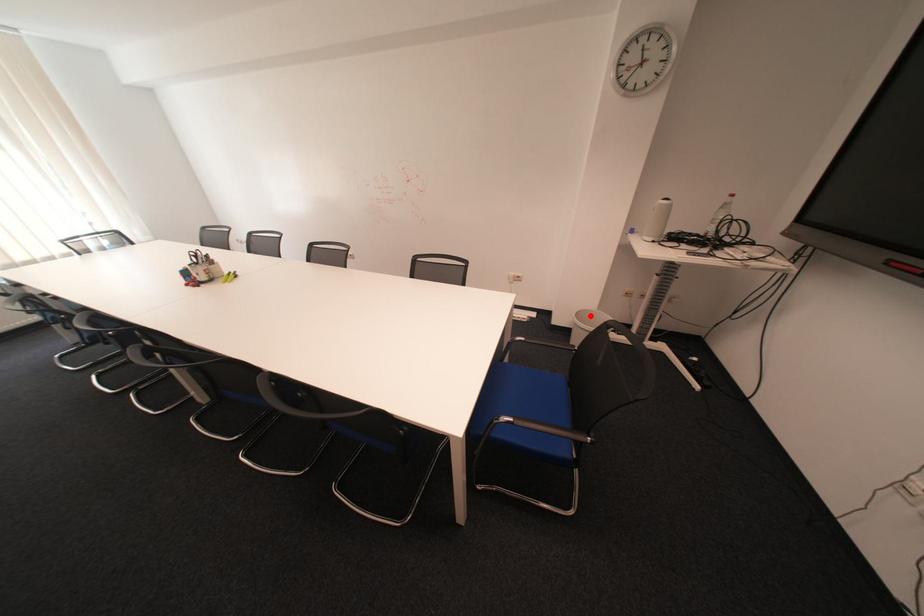
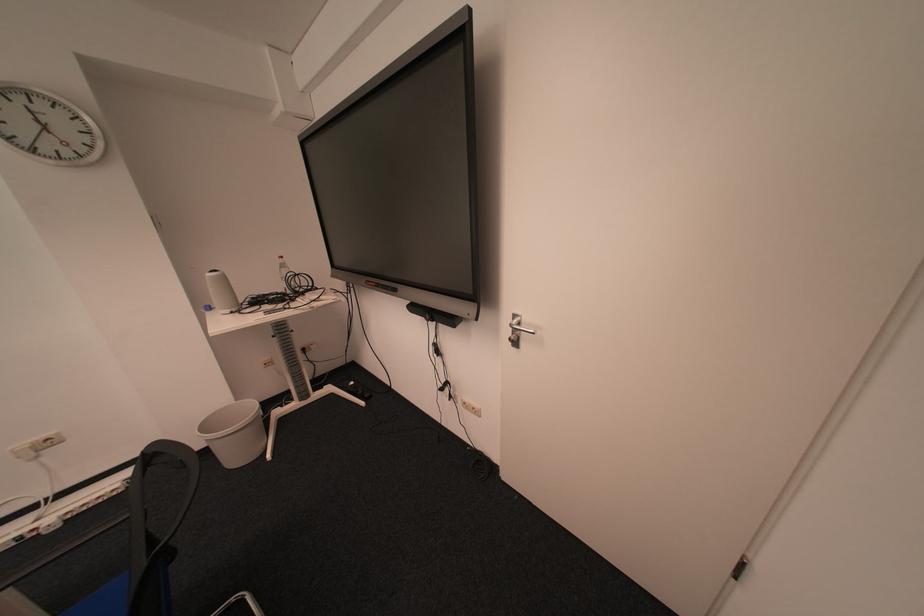
Question: A red point is marked in image1. In image2, is the corresponding 3D point closer to the camera or farther? Reply with the corresponding letter.

Choices:
 (A) The corresponding 3D point is closer.
 (B) The corresponding 3D point is farther.

Answer: (B)